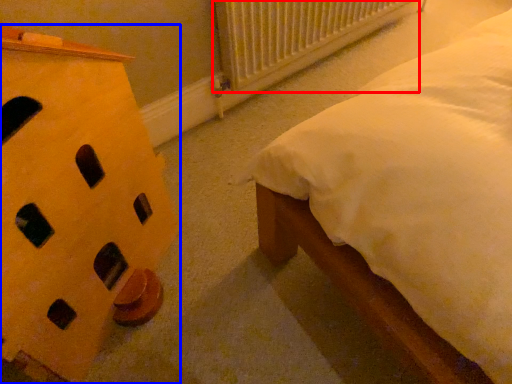
Question: Which object is further to the camera taking this photo, radiator (highlighted by a red box) or furniture (highlighted by a blue box)?

Choices:
 (A) radiator
 (B) furniture

Answer: (A)